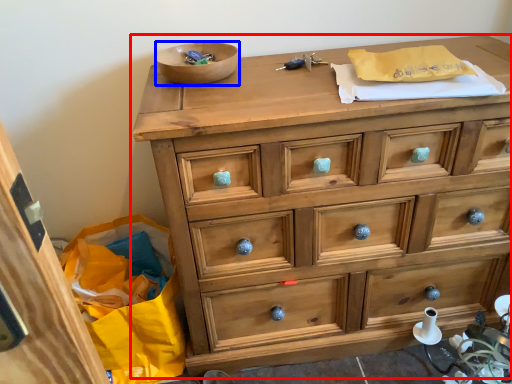
Question: Among these objects, which one is farthest to the camera, chest of drawers (highlighted by a red box) or bowl (highlighted by a blue box)?

Choices:
 (A) chest of drawers
 (B) bowl

Answer: (B)